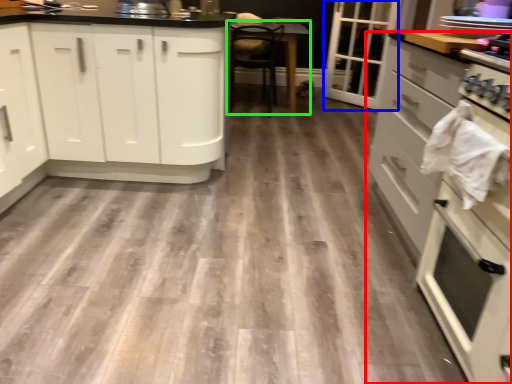
Question: Which is nearer to the cabinetry (highlighted by a red box)? glass door (highlighted by a blue box) or table (highlighted by a green box).

Choices:
 (A) glass door
 (B) table

Answer: (B)